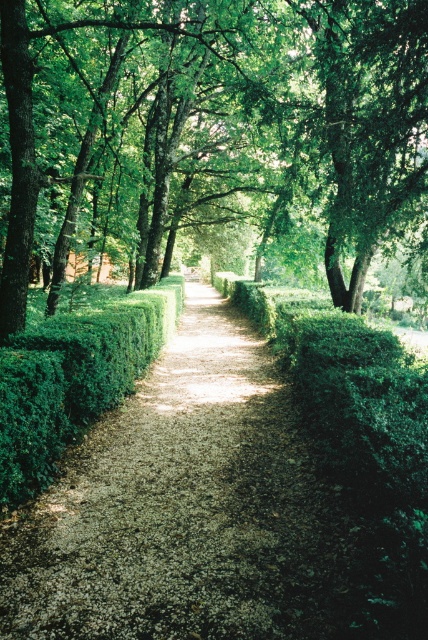
Between green hedge at center and green leafy tree at center, which one has more height?

green leafy tree at center is taller.

What are the coordinates of `green hedge at center` in the screenshot? It's located at (181, 508).

Can you confirm if green hedge at center is wider than green leafy hedge at center?

Indeed, green hedge at center has a greater width compared to green leafy hedge at center.

In the scene shown: Who is shorter, green hedge at center or green leafy hedge at center?

With less height is green hedge at center.

What do you see at coordinates (181, 508) in the screenshot? I see `green hedge at center` at bounding box center [181, 508].

You are a GUI agent. You are given a task and a screenshot of the screen. Output one action in this format:
    pyautogui.click(x=<x>, y=<y>)
    Task: Click on the green hedge at center
    This screenshot has width=428, height=640.
    Given the screenshot: What is the action you would take?
    point(181,508)

Based on the photo, which is more to the right, green leafy tree at center or green leafy hedge at center?

green leafy tree at center

Where is `green leafy tree at center`? The image size is (428, 640). green leafy tree at center is located at coordinates coord(250,118).